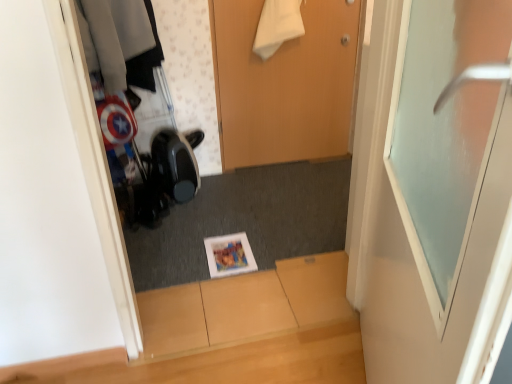
Find the location of a particular element. Image resolution: width=512 pixels, height=384 pixels. blank space situated above matte paper magazine at center (from a real-world perspective) is located at coordinates (228, 249).